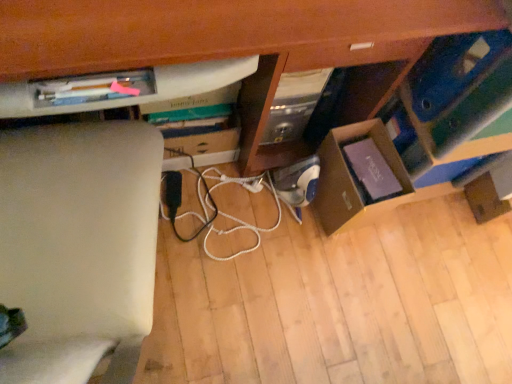
Question: Is cardboard box at lower right wider than white cord at center?

Choices:
 (A) no
 (B) yes

Answer: (B)

Question: Can you confirm if cardboard box at lower right is shorter than white cord at center?

Choices:
 (A) yes
 (B) no

Answer: (B)

Question: From a real-world perspective, is cardboard box at lower right under white cord at center?

Choices:
 (A) yes
 (B) no

Answer: (B)

Question: Is white cord at center surrounded by cardboard box at lower right?

Choices:
 (A) yes
 (B) no

Answer: (B)

Question: Is cardboard box at lower right to the left of white cord at center from the viewer's perspective?

Choices:
 (A) yes
 (B) no

Answer: (B)

Question: From the image's perspective, is cardboard box at lower right located beneath white cord at center?

Choices:
 (A) yes
 (B) no

Answer: (B)

Question: Are wooden computer desk at center and cardboard box at lower right beside each other?

Choices:
 (A) no
 (B) yes

Answer: (A)

Question: Considering the relative positions of wooden computer desk at center and cardboard box at lower right in the image provided, is wooden computer desk at center behind cardboard box at lower right?

Choices:
 (A) no
 (B) yes

Answer: (A)

Question: From the image's perspective, is wooden computer desk at center above cardboard box at lower right?

Choices:
 (A) yes
 (B) no

Answer: (A)

Question: Can you confirm if wooden computer desk at center is shorter than cardboard box at lower right?

Choices:
 (A) yes
 (B) no

Answer: (B)

Question: Is wooden computer desk at center closer to camera compared to cardboard box at lower right?

Choices:
 (A) yes
 (B) no

Answer: (A)

Question: Does wooden computer desk at center have a greater width compared to cardboard box at lower right?

Choices:
 (A) yes
 (B) no

Answer: (A)

Question: Is wooden computer desk at center surrounding blue cardboard box at lower right?

Choices:
 (A) yes
 (B) no

Answer: (B)